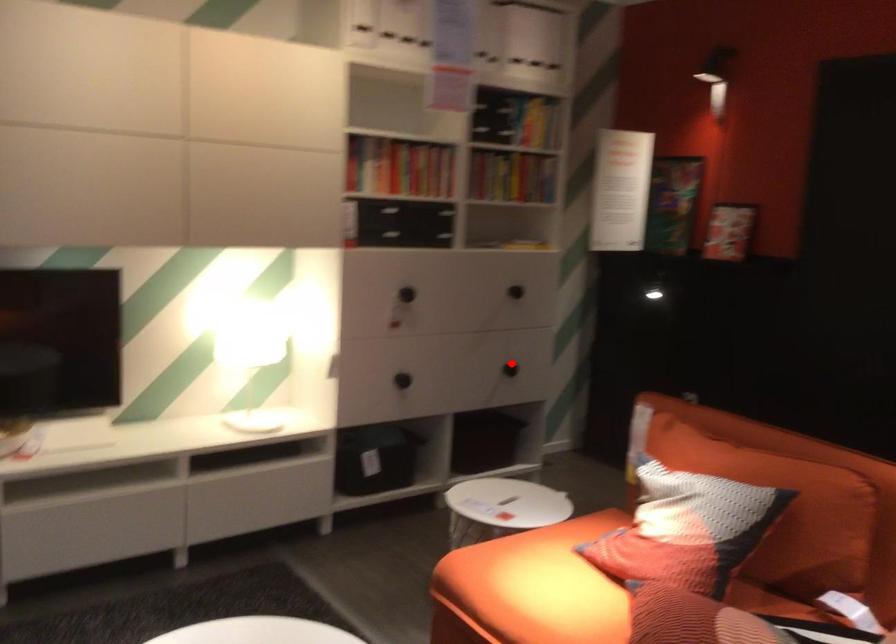
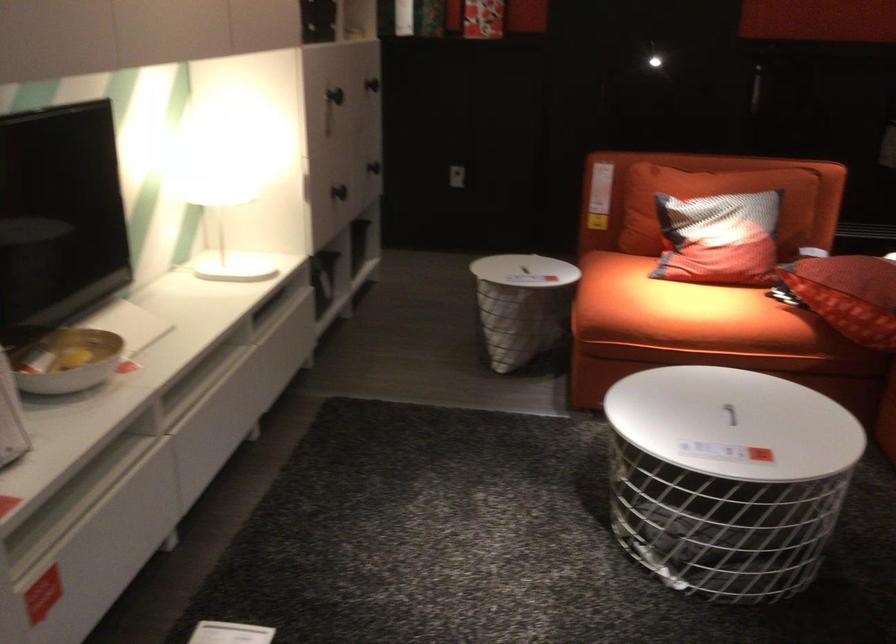
Find the pixel in the second image that matches the highlighted location in the first image.

(373, 167)